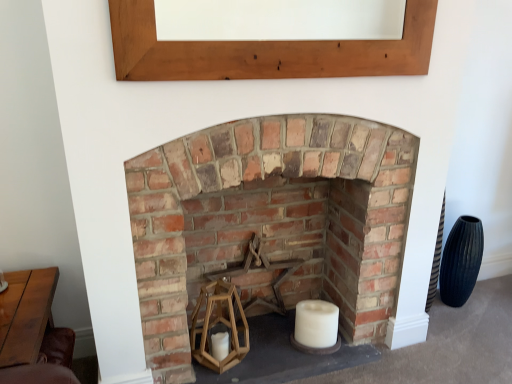
Question: From a real-world perspective, is wooden at center physically located above or below rustic brick fireplace at center?

Choices:
 (A) above
 (B) below

Answer: (B)

Question: Would you say wooden at center is inside or outside rustic brick fireplace at center?

Choices:
 (A) outside
 (B) inside

Answer: (B)

Question: Which is farther from the wooden table at lower left?

Choices:
 (A) light brown wood at upper center
 (B) white matte candle at center
 (C) wooden at center
 (D) rustic brick fireplace at center

Answer: (B)

Question: Which of these objects is positioned farthest from the wooden table at lower left?

Choices:
 (A) light brown wood at upper center
 (B) rustic brick fireplace at center
 (C) wooden at center
 (D) white matte candle at center

Answer: (D)